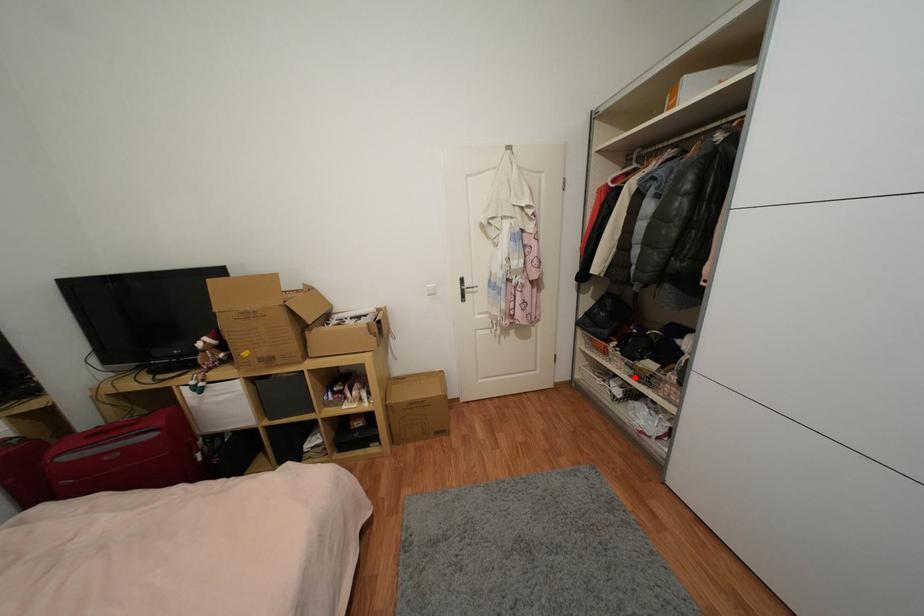
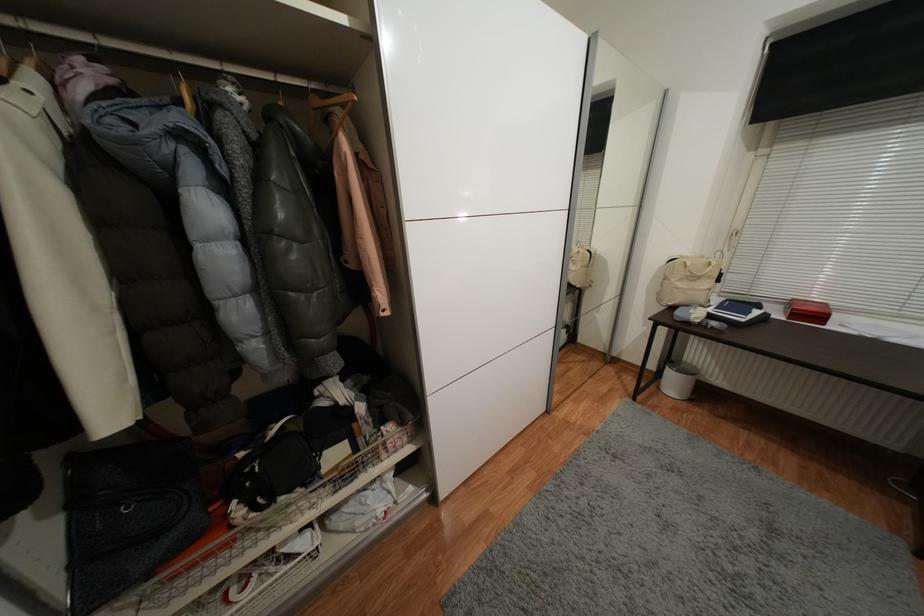
Question: I am providing you with two images of the same scene from different viewpoints. Given a red point in image1, look at the same physical point in image2. Is it:

Choices:
 (A) Closer to the viewpoint
 (B) Farther from the viewpoint

Answer: (B)